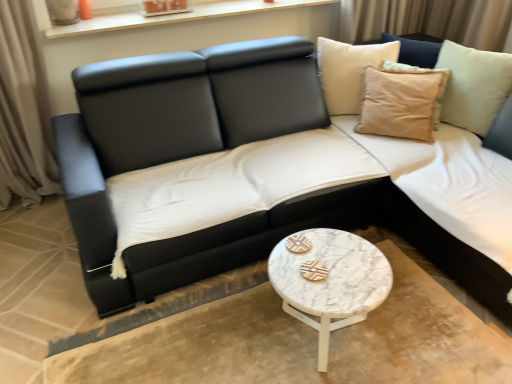
Question: Considering their positions, is black leather couch at center located in front of or behind beige cotton cushion at upper right?

Choices:
 (A) front
 (B) behind

Answer: (A)

Question: Is black leather couch at center taller or shorter than beige cotton cushion at upper right?

Choices:
 (A) short
 (B) tall

Answer: (B)

Question: Which object is the closest to the beige cotton cushion at upper right?

Choices:
 (A) black leather couch at center
 (B) white wood window sill at upper center
 (C) white marble coffee table at center

Answer: (A)

Question: Which object is positioned farthest from the beige cotton cushion at upper right?

Choices:
 (A) black leather couch at center
 (B) white marble coffee table at center
 (C) white wood window sill at upper center

Answer: (C)